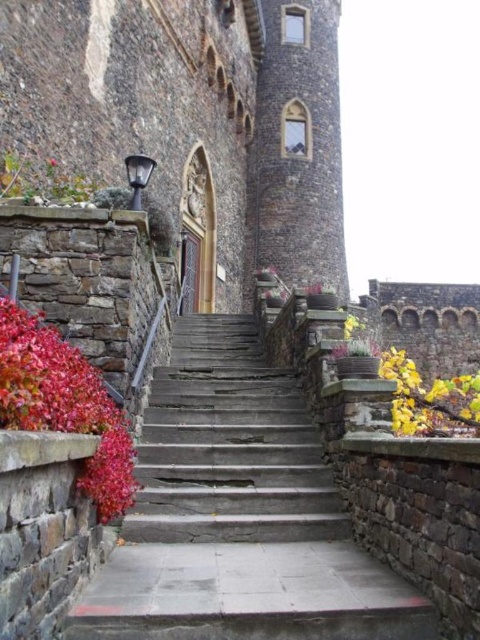
Can you confirm if stone stairs at center is wider than dark brown stone tower at upper center?

In fact, stone stairs at center might be narrower than dark brown stone tower at upper center.

Is point (178, 579) positioned behind point (319, 19)?

No, (178, 579) is in front of (319, 19).

Where is `stone stairs at center`? stone stairs at center is located at coordinates (239, 515).

Is dark brown stone tower at upper center taller than vivid red leaves at left?

Yes.

Between dark brown stone tower at upper center and vivid red leaves at left, which one appears on the right side from the viewer's perspective?

Positioned to the right is dark brown stone tower at upper center.

Where is `dark brown stone tower at upper center`? The image size is (480, 640). dark brown stone tower at upper center is located at coordinates (297, 148).

Which of these two, stone stairs at center or vivid red leaves at left, stands taller?

Standing taller between the two is vivid red leaves at left.

Does stone stairs at center have a smaller size compared to vivid red leaves at left?

No.

Is point (144, 481) closer to camera compared to point (3, 396)?

No, (144, 481) is behind (3, 396).

Where is `stone stairs at center`? stone stairs at center is located at coordinates (239, 515).